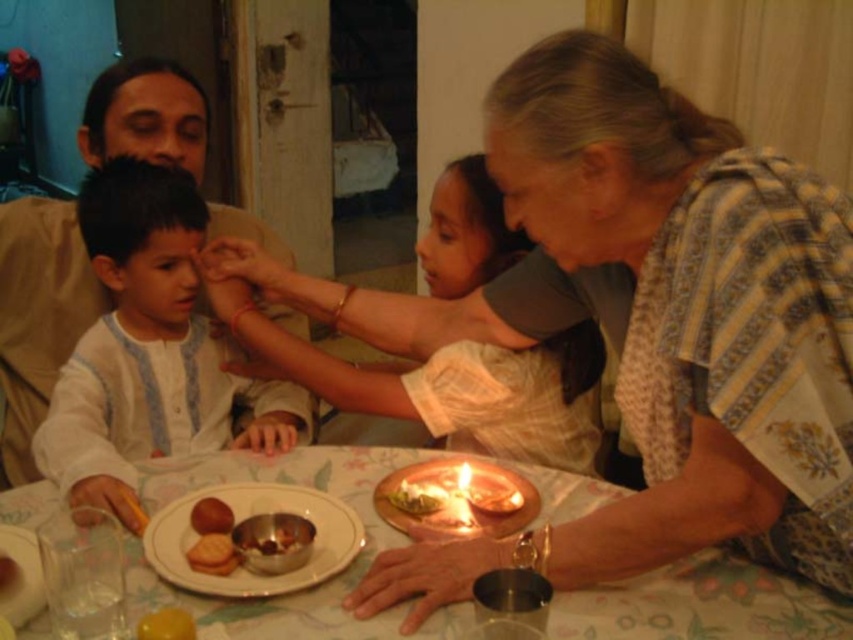
Can you confirm if light blue cotton shirt at center is taller than shiny metallic bowl at center?

Yes, light blue cotton shirt at center is taller than shiny metallic bowl at center.

Can you confirm if light blue cotton shirt at center is shorter than shiny metallic bowl at center?

No, light blue cotton shirt at center is not shorter than shiny metallic bowl at center.

Is point (225, 378) positioned before point (276, 544)?

No, (225, 378) is further to viewer.

Find the location of a particular element. The height and width of the screenshot is (640, 853). light blue cotton shirt at center is located at coordinates (148, 348).

Who is more forward, (x=321, y=572) or (x=463, y=465)?

Positioned in front is point (x=321, y=572).

Is white ceramic plate at center to the right of matte copper candle at center from the viewer's perspective?

Incorrect, white ceramic plate at center is not on the right side of matte copper candle at center.

Does point (167, 552) lie behind point (457, 515)?

That is False.

Find the location of a particular element. The width and height of the screenshot is (853, 640). white ceramic plate at center is located at coordinates (247, 516).

Which is behind, point (666, 392) or point (366, 508)?

The point (366, 508) is more distant.

This screenshot has width=853, height=640. Describe the element at coordinates (643, 324) in the screenshot. I see `floral-patterned sari at center` at that location.

Locate an element on the screen. floral-patterned sari at center is located at coordinates (643, 324).